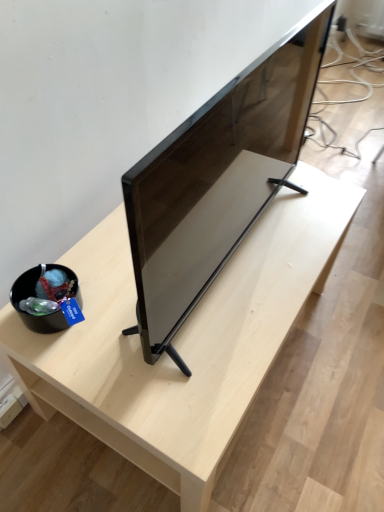
Question: Is matte black tv at center to the left or to the right of light wood table at center in the image?

Choices:
 (A) right
 (B) left

Answer: (A)

Question: From the image's perspective, is matte black tv at center above or below light wood table at center?

Choices:
 (A) above
 (B) below

Answer: (A)

Question: From a real-world perspective, relative to light wood table at center, is matte black tv at center vertically above or below?

Choices:
 (A) above
 (B) below

Answer: (A)

Question: Is light wood table at center in front of or behind matte black tv at center in the image?

Choices:
 (A) behind
 (B) front

Answer: (A)

Question: In terms of width, does light wood table at center look wider or thinner when compared to matte black tv at center?

Choices:
 (A) thin
 (B) wide

Answer: (B)

Question: Considering the positions of light wood table at center and matte black tv at center in the image, is light wood table at center taller or shorter than matte black tv at center?

Choices:
 (A) short
 (B) tall

Answer: (A)

Question: Is light wood table at center spatially inside matte black tv at center, or outside of it?

Choices:
 (A) outside
 (B) inside

Answer: (A)